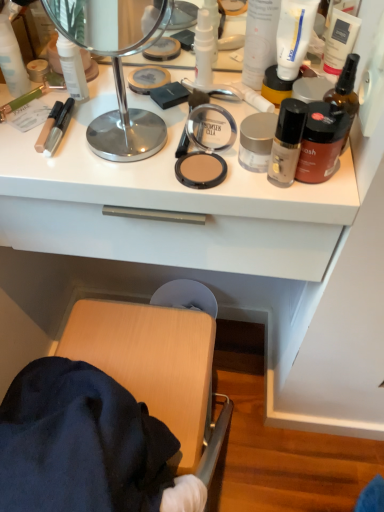
Identify the location of vacant space positioned to the left of brown glass spray bottle at upper right, which is the 10th toiletry in left-to-right order. (194, 153).